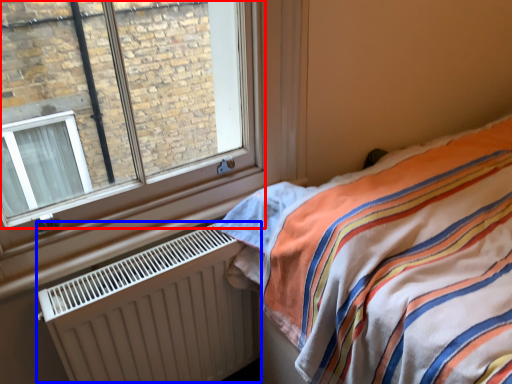
Question: Which of the following is the farthest to the observer, window (highlighted by a red box) or radiator (highlighted by a blue box)?

Choices:
 (A) window
 (B) radiator

Answer: (B)